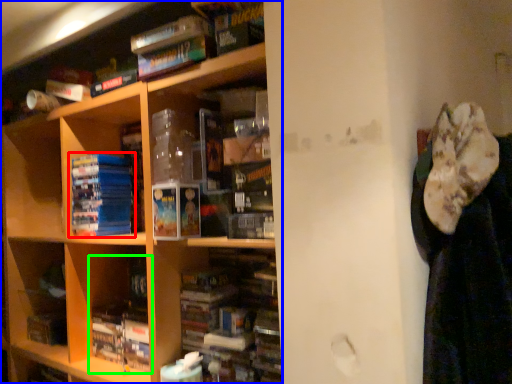
Question: Which is farther away from book (highlighted by a red box)? shelf (highlighted by a blue box) or book (highlighted by a green box)?

Choices:
 (A) shelf
 (B) book

Answer: (B)